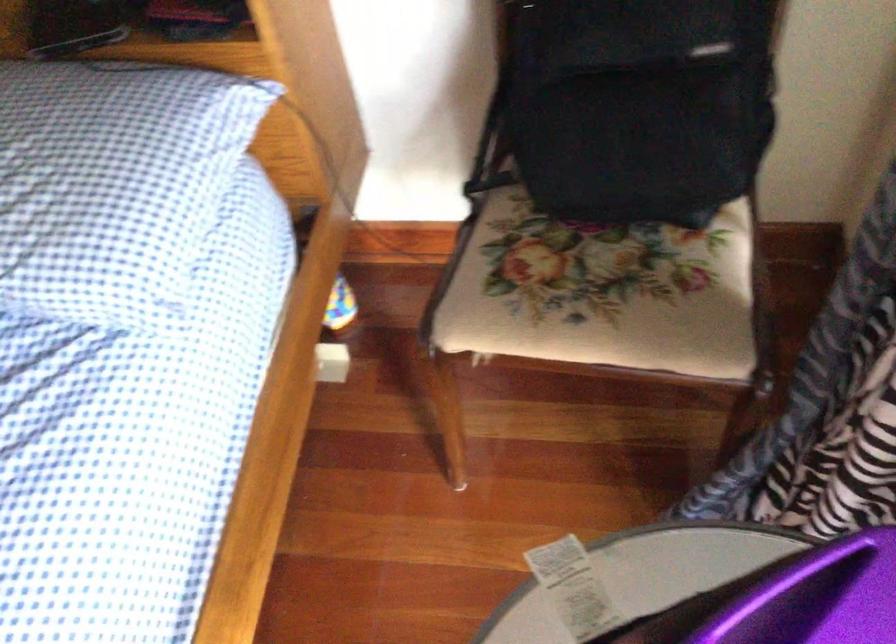
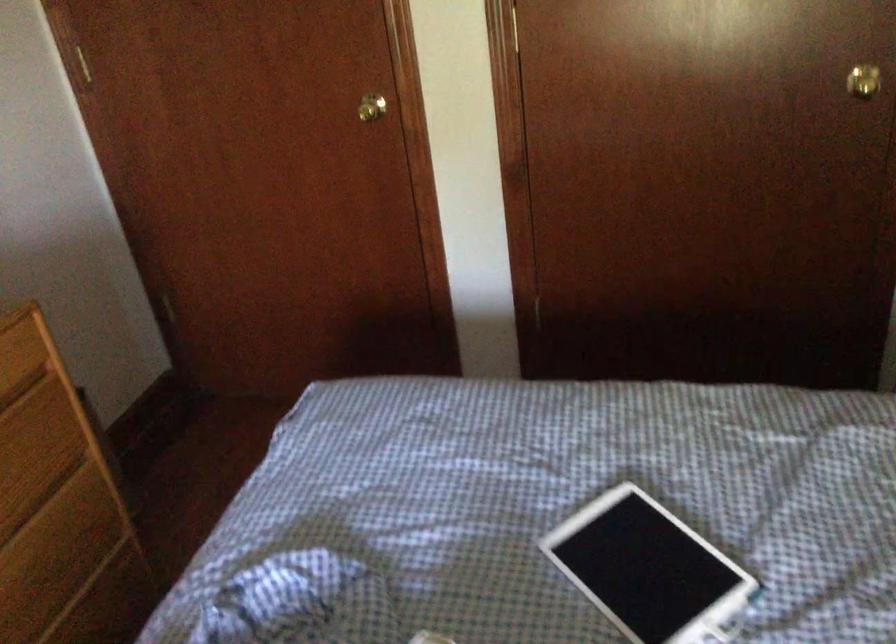
Based on the continuous images, in which direction is the camera rotating?

The rotation direction of the camera is left-down.